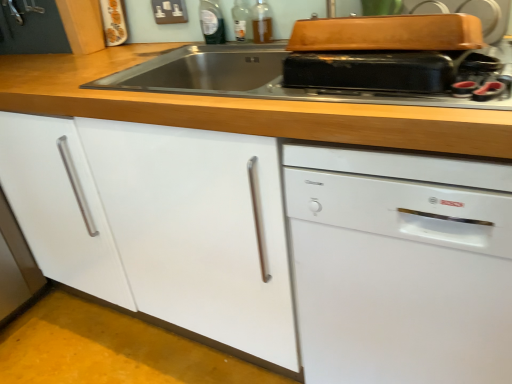
What do you see at coordinates (241, 108) in the screenshot?
I see `wooden at upper center` at bounding box center [241, 108].

Image resolution: width=512 pixels, height=384 pixels. Describe the element at coordinates (261, 22) in the screenshot. I see `translucent glass bottle at upper center, acting as the 3th bottle starting from the left` at that location.

Measure the distance between white plastic electric outlet at upper center and camera.

The depth of white plastic electric outlet at upper center is 1.51 meters.

The image size is (512, 384). What do you see at coordinates (212, 22) in the screenshot?
I see `transparent plastic bottle at upper center, the first bottle when ordered from left to right` at bounding box center [212, 22].

Describe the element at coordinates (159, 223) in the screenshot. I see `white matte cabinet at center` at that location.

Locate an element on the screen. The image size is (512, 384). transparent glass bottle at upper center, the 2th bottle in the right-to-left sequence is located at coordinates (241, 21).

Locate an element on the screen. matte black toaster at upper center is located at coordinates (370, 71).

Image resolution: width=512 pixels, height=384 pixels. Describe the element at coordinates (400, 266) in the screenshot. I see `white glossy dishwasher at right` at that location.

Identify the location of wooden at upper center. (241, 108).

Is transparent glass bottle at upper center, the 2th bottle in the right-to-left sequence, facing away from white matte cabinet at center?

That's not correct — transparent glass bottle at upper center, the 2th bottle in the right-to-left sequence, is not looking away from white matte cabinet at center.

Identify the location of cabinetry below the transparent glass bottle at upper center, the 2th bottle in the right-to-left sequence (from a real-world perspective). The width and height of the screenshot is (512, 384). pyautogui.click(x=159, y=223).

Which is correct: transparent glass bottle at upper center, acting as the 2th bottle starting from the left, is inside white matte cabinet at center, or outside of it?

transparent glass bottle at upper center, acting as the 2th bottle starting from the left, is outside white matte cabinet at center.

Are white plastic electric outlet at upper center and transparent plastic bottle at upper center, the first bottle when ordered from left to right, beside each other?

white plastic electric outlet at upper center and transparent plastic bottle at upper center, the first bottle when ordered from left to right, are clearly separated.

From a real-world perspective, which is physically below, white plastic electric outlet at upper center or transparent plastic bottle at upper center, the first bottle when ordered from left to right?

transparent plastic bottle at upper center, the first bottle when ordered from left to right, is physically lower.

From the image's perspective, is white plastic electric outlet at upper center above or below transparent plastic bottle at upper center, which is counted as the third bottle, starting from the right?

white plastic electric outlet at upper center is situated higher than transparent plastic bottle at upper center, which is counted as the third bottle, starting from the right, in the image.

Does matte black toaster at upper center turn towards transparent plastic bottle at upper center, the first bottle when ordered from left to right?

No, matte black toaster at upper center is not aimed at transparent plastic bottle at upper center, the first bottle when ordered from left to right.

Would you say matte black toaster at upper center is outside transparent plastic bottle at upper center, which is counted as the third bottle, starting from the right?

Indeed, matte black toaster at upper center is completely outside transparent plastic bottle at upper center, which is counted as the third bottle, starting from the right.

Considering the relative sizes of matte black toaster at upper center and transparent plastic bottle at upper center, which is counted as the third bottle, starting from the right, in the image provided, is matte black toaster at upper center bigger than transparent plastic bottle at upper center, which is counted as the third bottle, starting from the right,?

Indeed, matte black toaster at upper center has a larger size compared to transparent plastic bottle at upper center, which is counted as the third bottle, starting from the right.

Are matte black toaster at upper center and transparent plastic bottle at upper center, which is counted as the third bottle, starting from the right, beside each other?

There is a gap between matte black toaster at upper center and transparent plastic bottle at upper center, which is counted as the third bottle, starting from the right.

Where is `the 2nd bottle below the transparent plastic bottle at upper center, the first bottle when ordered from left to right (from the image's perspective)`? This screenshot has width=512, height=384. the 2nd bottle below the transparent plastic bottle at upper center, the first bottle when ordered from left to right (from the image's perspective) is located at coordinates (261, 22).

From the picture: Is the depth of translucent glass bottle at upper center, which is the 1th bottle in right-to-left order, less than that of transparent plastic bottle at upper center, which is counted as the third bottle, starting from the right?

That is True.

Can you confirm if translucent glass bottle at upper center, which is the 1th bottle in right-to-left order, is smaller than transparent plastic bottle at upper center, the first bottle when ordered from left to right?

Correct, translucent glass bottle at upper center, which is the 1th bottle in right-to-left order, occupies less space than transparent plastic bottle at upper center, the first bottle when ordered from left to right.

Which is more to the right, translucent glass bottle at upper center, acting as the 3th bottle starting from the left, or transparent plastic bottle at upper center, which is counted as the third bottle, starting from the right?

From the viewer's perspective, translucent glass bottle at upper center, acting as the 3th bottle starting from the left, appears more on the right side.

Is white glossy dishwasher at right surrounding translucent glass bottle at upper center, which is the 1th bottle in right-to-left order?

Actually, translucent glass bottle at upper center, which is the 1th bottle in right-to-left order, is outside white glossy dishwasher at right.

Could you tell me if white glossy dishwasher at right is turned towards translucent glass bottle at upper center, which is the 1th bottle in right-to-left order?

No.

Does white glossy dishwasher at right have a smaller size compared to translucent glass bottle at upper center, which is the 1th bottle in right-to-left order?

Actually, white glossy dishwasher at right might be larger than translucent glass bottle at upper center, which is the 1th bottle in right-to-left order.

Which is more to the left, white glossy dishwasher at right or translucent glass bottle at upper center, which is the 1th bottle in right-to-left order?

Positioned to the left is translucent glass bottle at upper center, which is the 1th bottle in right-to-left order.

The width and height of the screenshot is (512, 384). I want to click on cabinetry on the left of translucent glass bottle at upper center, which is the 1th bottle in right-to-left order, so click(159, 223).

Could you tell me if white matte cabinet at center is turned towards translucent glass bottle at upper center, acting as the 3th bottle starting from the left?

No, white matte cabinet at center is not turned towards translucent glass bottle at upper center, acting as the 3th bottle starting from the left.

From the image's perspective, relative to translucent glass bottle at upper center, which is the 1th bottle in right-to-left order, is white matte cabinet at center above or below?

Based on their image positions, white matte cabinet at center is located beneath translucent glass bottle at upper center, which is the 1th bottle in right-to-left order.

Is the depth of white matte cabinet at center less than that of translucent glass bottle at upper center, which is the 1th bottle in right-to-left order?

That is True.

Is point (208, 36) closer to camera compared to point (243, 14)?

No, it is not.

Would you say transparent plastic bottle at upper center, the first bottle when ordered from left to right, contains transparent glass bottle at upper center, acting as the 2th bottle starting from the left?

No, transparent glass bottle at upper center, acting as the 2th bottle starting from the left, is located outside of transparent plastic bottle at upper center, the first bottle when ordered from left to right.

Is the position of transparent plastic bottle at upper center, the first bottle when ordered from left to right, less distant than that of transparent glass bottle at upper center, acting as the 2th bottle starting from the left?

No, transparent plastic bottle at upper center, the first bottle when ordered from left to right, is further to the viewer.

What are the coordinates of `bottle that is the 2nd object to the right of the white matte cabinet at center, starting at the anchor` in the screenshot? It's located at (241, 21).

Find the location of a particular element. Image resolution: width=512 pixels, height=384 pixels. bottle that is the 1st one below the white plastic electric outlet at upper center (from a real-world perspective) is located at coordinates (212, 22).

Estimate the real-world distances between objects in this image. Which object is further from transparent glass bottle at upper center, acting as the 2th bottle starting from the left, white matte cabinet at center or white glossy dishwasher at right?

Among the two, white glossy dishwasher at right is located further to transparent glass bottle at upper center, acting as the 2th bottle starting from the left.

Which object lies further to the anchor point translucent glass bottle at upper center, which is the 1th bottle in right-to-left order, white plastic electric outlet at upper center or matte black toaster at upper center?

matte black toaster at upper center.

Looking at the image, which one is located further to matte black toaster at upper center, transparent glass bottle at upper center, acting as the 2th bottle starting from the left, or white plastic electric outlet at upper center?

Result: white plastic electric outlet at upper center is further to matte black toaster at upper center.

When comparing their distances from transparent glass bottle at upper center, the 2th bottle in the right-to-left sequence, does translucent glass bottle at upper center, acting as the 3th bottle starting from the left, or matte black toaster at upper center seem further?

matte black toaster at upper center lies further to transparent glass bottle at upper center, the 2th bottle in the right-to-left sequence, than the other object.

Estimate the real-world distances between objects in this image. Which object is further from white glossy dishwasher at right, matte black toaster at upper center or wooden at upper center?

matte black toaster at upper center.

Estimate the real-world distances between objects in this image. Which object is further from matte black toaster at upper center, transparent plastic bottle at upper center, which is counted as the third bottle, starting from the right, or transparent glass bottle at upper center, acting as the 2th bottle starting from the left?

Based on the image, transparent plastic bottle at upper center, which is counted as the third bottle, starting from the right, appears to be further to matte black toaster at upper center.

Based on their spatial positions, is transparent plastic bottle at upper center, the first bottle when ordered from left to right, or white glossy dishwasher at right further from white matte cabinet at center?

transparent plastic bottle at upper center, the first bottle when ordered from left to right.

Considering their positions, is white plastic electric outlet at upper center positioned further to white glossy dishwasher at right than transparent plastic bottle at upper center, the first bottle when ordered from left to right?

white plastic electric outlet at upper center.

Identify the location of countertop located between white glossy dishwasher at right and translucent glass bottle at upper center, which is the 1th bottle in right-to-left order, in the depth direction. (241, 108).

The height and width of the screenshot is (384, 512). Identify the location of bottle between wooden at upper center and transparent glass bottle at upper center, acting as the 2th bottle starting from the left, along the z-axis. (261, 22).

You are a GUI agent. You are given a task and a screenshot of the screen. Output one action in this format:
    pyautogui.click(x=<x>, y=<y>)
    Task: Click on the countertop between white glossy dishwasher at right and white plastic electric outlet at upper center from front to back
    The height and width of the screenshot is (384, 512).
    Given the screenshot: What is the action you would take?
    pyautogui.click(x=241, y=108)

Identify the location of kitchen appliance positioned between white glossy dishwasher at right and white plastic electric outlet at upper center from near to far. (370, 71).